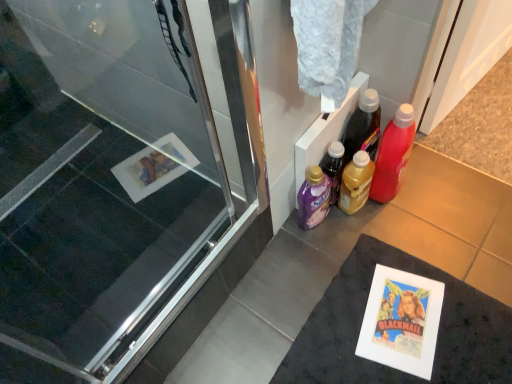
What do you see at coordinates (356, 182) in the screenshot?
I see `translucent plastic bottle at center-right, positioned as the 2th bottle in left-to-right order` at bounding box center [356, 182].

This screenshot has width=512, height=384. What do you see at coordinates (97, 179) in the screenshot?
I see `transparent glass screen door at left` at bounding box center [97, 179].

What is the approximate height of purple plastic bottle at lower center, which is the third bottle in right-to-left order?

The height of purple plastic bottle at lower center, which is the third bottle in right-to-left order, is 27.72 centimeters.

The width and height of the screenshot is (512, 384). Describe the element at coordinates (313, 198) in the screenshot. I see `purple plastic bottle at lower center, acting as the first bottle starting from the left` at that location.

Identify the location of translucent plastic bottle at center-right, positioned as the 2th bottle in left-to-right order. [x=356, y=182].

Is transparent glass screen door at left aimed at purple plastic bottle at lower center, acting as the first bottle starting from the left?

No, transparent glass screen door at left is not oriented towards purple plastic bottle at lower center, acting as the first bottle starting from the left.

From the image's perspective, which one is positioned lower, transparent glass screen door at left or purple plastic bottle at lower center, acting as the first bottle starting from the left?

transparent glass screen door at left appears lower in the image.

This screenshot has height=384, width=512. I want to click on screen door on the left side of purple plastic bottle at lower center, acting as the first bottle starting from the left, so click(x=97, y=179).

Considering the positions of objects transparent glass screen door at left and purple plastic bottle at lower center, which is the third bottle in right-to-left order, in the image provided, who is in front, transparent glass screen door at left or purple plastic bottle at lower center, which is the third bottle in right-to-left order,?

transparent glass screen door at left is closer to the camera.

Is purple plastic bottle at lower center, acting as the first bottle starting from the left, inside translucent plastic bottle at center-right, positioned as the 2th bottle in left-to-right order?

No.

Looking at the image, does translucent plastic bottle at center-right, arranged as the 2th bottle when viewed from the right, seem bigger or smaller compared to purple plastic bottle at lower center, acting as the first bottle starting from the left?

In the image, translucent plastic bottle at center-right, arranged as the 2th bottle when viewed from the right, appears to be larger than purple plastic bottle at lower center, acting as the first bottle starting from the left.

At what (x,y) coordinates should I click in order to perform the action: click on bottle located on the left of translucent plastic bottle at center-right, positioned as the 2th bottle in left-to-right order. Please return your answer as a coordinate pair (x, y). The width and height of the screenshot is (512, 384). Looking at the image, I should click on (313, 198).

In order to click on bottle that is the 2nd one below the translucent plastic bottle at right, the 3th bottle when ordered from left to right (from a real-world perspective) in this screenshot , I will do `click(356, 182)`.

Is translucent plastic bottle at center-right, arranged as the 2th bottle when viewed from the right, at the right side of translucent plastic bottle at right, the 3th bottle when ordered from left to right?

No, translucent plastic bottle at center-right, arranged as the 2th bottle when viewed from the right, is not to the right of translucent plastic bottle at right, the 3th bottle when ordered from left to right.

Measure the distance from translucent plastic bottle at center-right, arranged as the 2th bottle when viewed from the right, to translucent plastic bottle at right, the 3th bottle when ordered from left to right.

translucent plastic bottle at center-right, arranged as the 2th bottle when viewed from the right, is 9.17 centimeters from translucent plastic bottle at right, the 3th bottle when ordered from left to right.

Which is correct: translucent plastic bottle at center-right, arranged as the 2th bottle when viewed from the right, is inside translucent plastic bottle at right, the 3th bottle when ordered from left to right, or outside of it?

The correct answer is: outside.

Can we say purple plastic bottle at lower center, which is the third bottle in right-to-left order, lies outside white matte bath mat at lower right?

Yes, purple plastic bottle at lower center, which is the third bottle in right-to-left order, is outside of white matte bath mat at lower right.

Is purple plastic bottle at lower center, acting as the first bottle starting from the left, looking in the opposite direction of white matte bath mat at lower right?

purple plastic bottle at lower center, acting as the first bottle starting from the left, is not turned away from white matte bath mat at lower right.

Considering the relative sizes of white matte bath mat at lower right and purple plastic bottle at lower center, acting as the first bottle starting from the left, in the image provided, is white matte bath mat at lower right taller than purple plastic bottle at lower center, acting as the first bottle starting from the left,?

Incorrect, the height of white matte bath mat at lower right is not larger of that of purple plastic bottle at lower center, acting as the first bottle starting from the left.

Between white matte bath mat at lower right and purple plastic bottle at lower center, which is the third bottle in right-to-left order, which one is positioned behind?

purple plastic bottle at lower center, which is the third bottle in right-to-left order, is behind.

Considering the relative sizes of white matte bath mat at lower right and purple plastic bottle at lower center, acting as the first bottle starting from the left, in the image provided, is white matte bath mat at lower right wider than purple plastic bottle at lower center, acting as the first bottle starting from the left,?

Correct, the width of white matte bath mat at lower right exceeds that of purple plastic bottle at lower center, acting as the first bottle starting from the left.

From a real-world perspective, does white matte bath mat at lower right stand above purple plastic bottle at lower center, acting as the first bottle starting from the left?

No, from a real-world perspective, white matte bath mat at lower right is not on top of purple plastic bottle at lower center, acting as the first bottle starting from the left.

Can you confirm if transparent glass screen door at left is taller than white matte bath mat at lower right?

Yes.

Which is in front, point (117, 13) or point (300, 367)?

Positioned in front is point (117, 13).

In the scene shown: How different are the orientations of transparent glass screen door at left and white matte bath mat at lower right in degrees?

They differ by 90.4 degrees in their facing directions.

Where is `bath mat behind the transparent glass screen door at left`? bath mat behind the transparent glass screen door at left is located at coordinates (362, 320).

Which is closer to the camera, (397,144) or (362,178)?

Point (397,144).

From a real-world perspective, which is physically above, translucent plastic bottle at right, the 3th bottle when ordered from left to right, or translucent plastic bottle at center-right, arranged as the 2th bottle when viewed from the right?

translucent plastic bottle at right, the 3th bottle when ordered from left to right.

Which of these two, translucent plastic bottle at right, which is the 1th bottle in right-to-left order, or translucent plastic bottle at center-right, positioned as the 2th bottle in left-to-right order, is wider?

Wider between the two is translucent plastic bottle at right, which is the 1th bottle in right-to-left order.

At what (x,y) coordinates should I click in order to perform the action: click on the 1st bottle to the right of the transparent glass screen door at left, counting from the anchor's position. Please return your answer as a coordinate pair (x, y). Looking at the image, I should click on (313, 198).

Locate an element on the screen. bottle below the translucent plastic bottle at center-right, positioned as the 2th bottle in left-to-right order (from the image's perspective) is located at coordinates (313, 198).

When comparing their distances from purple plastic bottle at lower center, which is the third bottle in right-to-left order, does translucent plastic bottle at center-right, positioned as the 2th bottle in left-to-right order, or white matte bath mat at lower right seem further?

Among the two, white matte bath mat at lower right is located further to purple plastic bottle at lower center, which is the third bottle in right-to-left order.

When comparing their distances from transparent glass screen door at left, does white matte bath mat at lower right or purple plastic bottle at lower center, acting as the first bottle starting from the left, seem closer?

Among the two, purple plastic bottle at lower center, acting as the first bottle starting from the left, is located nearer to transparent glass screen door at left.

Estimate the real-world distances between objects in this image. Which object is closer to translucent plastic bottle at center-right, positioned as the 2th bottle in left-to-right order, translucent plastic bottle at right, the 3th bottle when ordered from left to right, or transparent glass screen door at left?

translucent plastic bottle at right, the 3th bottle when ordered from left to right, is closer to translucent plastic bottle at center-right, positioned as the 2th bottle in left-to-right order.

Looking at the image, which one is located closer to white matte bath mat at lower right, purple plastic bottle at lower center, which is the third bottle in right-to-left order, or translucent plastic bottle at right, the 3th bottle when ordered from left to right?

purple plastic bottle at lower center, which is the third bottle in right-to-left order, lies closer to white matte bath mat at lower right than the other object.

Estimate the real-world distances between objects in this image. Which object is closer to white matte bath mat at lower right, transparent glass screen door at left or translucent plastic bottle at center-right, arranged as the 2th bottle when viewed from the right?

translucent plastic bottle at center-right, arranged as the 2th bottle when viewed from the right, is closer to white matte bath mat at lower right.

Estimate the real-world distances between objects in this image. Which object is closer to purple plastic bottle at lower center, acting as the first bottle starting from the left, white matte bath mat at lower right or translucent plastic bottle at center-right, positioned as the 2th bottle in left-to-right order?

translucent plastic bottle at center-right, positioned as the 2th bottle in left-to-right order, is closer to purple plastic bottle at lower center, acting as the first bottle starting from the left.

Looking at this image, when comparing their distances from translucent plastic bottle at right, the 3th bottle when ordered from left to right, does transparent glass screen door at left or white matte bath mat at lower right seem further?

Based on the image, transparent glass screen door at left appears to be further to translucent plastic bottle at right, the 3th bottle when ordered from left to right.

When comparing their distances from translucent plastic bottle at right, which is the 1th bottle in right-to-left order, does white matte bath mat at lower right or translucent plastic bottle at center-right, arranged as the 2th bottle when viewed from the right, seem closer?

translucent plastic bottle at center-right, arranged as the 2th bottle when viewed from the right, is positioned closer to the anchor translucent plastic bottle at right, which is the 1th bottle in right-to-left order.

I want to click on bottle between purple plastic bottle at lower center, acting as the first bottle starting from the left, and translucent plastic bottle at right, the 3th bottle when ordered from left to right, in the horizontal direction, so tap(356, 182).

Identify the location of bottle situated between transparent glass screen door at left and translucent plastic bottle at center-right, arranged as the 2th bottle when viewed from the right, from left to right. (313, 198).

I want to click on bath mat between transparent glass screen door at left and translucent plastic bottle at right, which is the 1th bottle in right-to-left order, from left to right, so click(x=362, y=320).

This screenshot has width=512, height=384. What are the coordinates of `bottle between translucent plastic bottle at center-right, positioned as the 2th bottle in left-to-right order, and white matte bath mat at lower right in the up-down direction` in the screenshot? It's located at (313, 198).